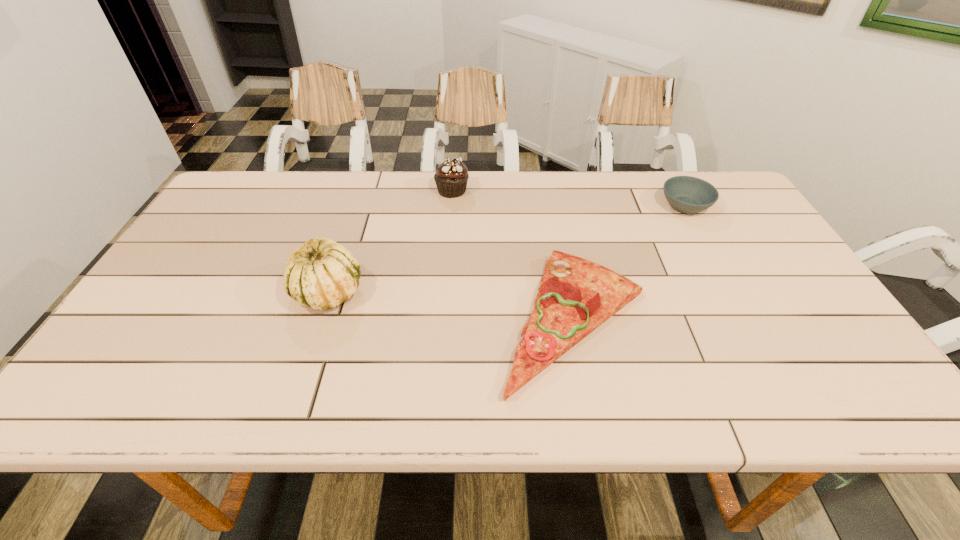
Point out which object is positioned as the third nearest to the soup bowl. Please provide its 2D coordinates. Your answer should be formatted as a tuple, i.e. [(x, y)], where the tuple contains the x and y coordinates of a point satisfying the conditions above.

[(322, 274)]

I want to click on object that is the third closest to the soup bowl, so click(322, 274).

Identify the location of free location that satisfies the following two spatial constraints: 1. on the front side of the third shortest object; 2. on the left side of the soup bowl. (451, 206).